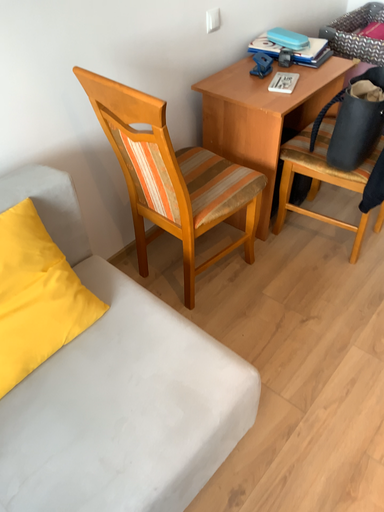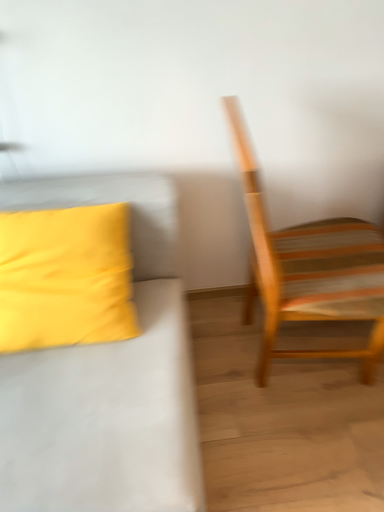
Question: How did the camera likely rotate when shooting the video?

Choices:
 (A) rotated downward
 (B) rotated upward

Answer: (B)